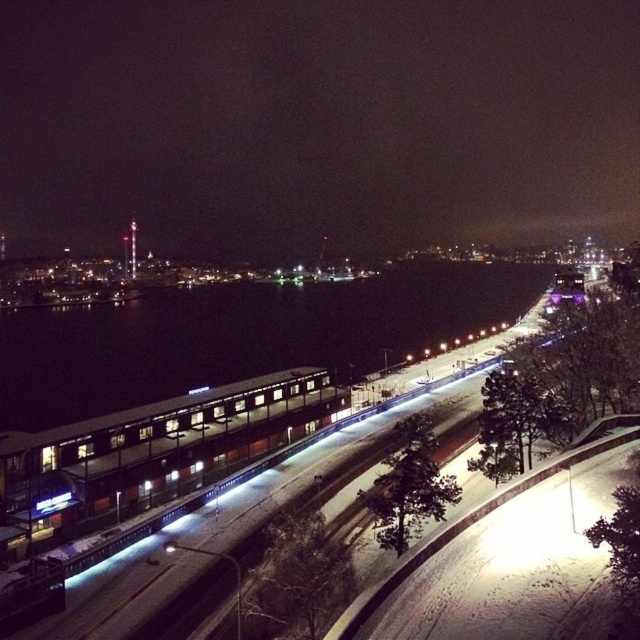
From the picture: Can you confirm if dark glassy water at center is taller than black water at center?

Yes, dark glassy water at center is taller than black water at center.

Based on the photo, can you confirm if dark glassy water at center is thinner than black water at center?

No.

Between point (1, 176) and point (390, 305), which one is positioned in front?

Positioned in front is point (390, 305).

At what (x,y) coordinates should I click in order to perform the action: click on dark glassy water at center. Please return your answer as a coordinate pair (x, y). The height and width of the screenshot is (640, 640). Looking at the image, I should click on (316, 124).

Is point (320, 33) positioned in front of point (211, 470)?

That is False.

The height and width of the screenshot is (640, 640). I want to click on dark glassy water at center, so click(x=316, y=124).

Between point (118, 321) and point (236, 436), which one is positioned behind?

The point (118, 321) is more distant.

Can you confirm if black water at center is positioned to the right of matte glass passenger train at center?

Indeed, black water at center is positioned on the right side of matte glass passenger train at center.

The image size is (640, 640). I want to click on black water at center, so click(243, 336).